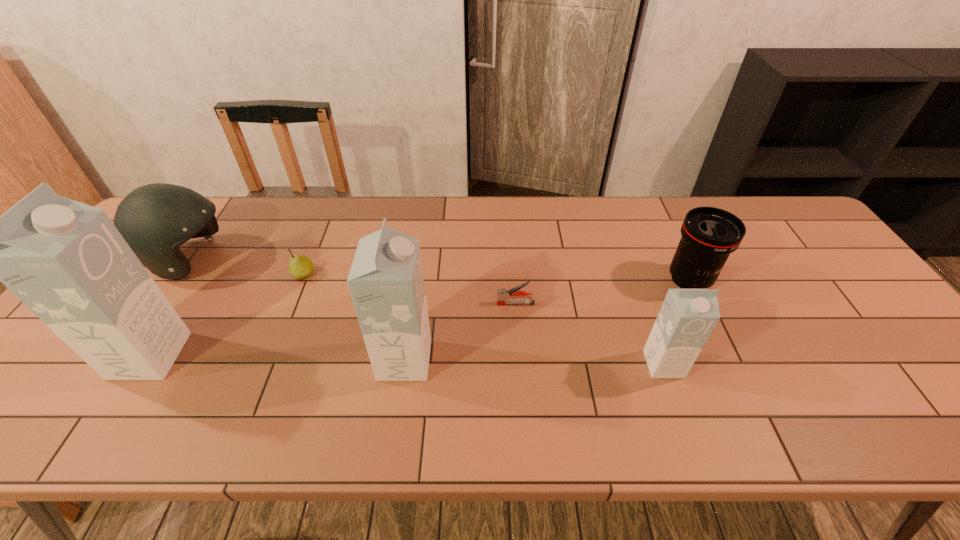
I want to click on the leftmost carton, so click(x=66, y=261).

Image resolution: width=960 pixels, height=540 pixels. What are the coordinates of `the second tallest carton` in the screenshot? It's located at (386, 282).

You are a GUI agent. You are given a task and a screenshot of the screen. Output one action in this format:
    pyautogui.click(x=<x>, y=<y>)
    Task: Click on the second tallest object
    
    Given the screenshot: What is the action you would take?
    pyautogui.click(x=386, y=282)

This screenshot has height=540, width=960. What are the coordinates of `the second object from right to left` in the screenshot? It's located at (687, 317).

Identify the location of the rightmost carton. Image resolution: width=960 pixels, height=540 pixels. (687, 317).

At what (x,y) coordinates should I click in order to perform the action: click on the rightmost object. Please return your answer as a coordinate pair (x, y). Looking at the image, I should click on (709, 234).

I want to click on telephoto lens, so click(709, 234).

Find the location of a particular element. The height and width of the screenshot is (540, 960). football helmet is located at coordinates (156, 219).

The width and height of the screenshot is (960, 540). What are the coordinates of `the third object from right to left` in the screenshot? It's located at pyautogui.click(x=503, y=295).

Locate an element on the screen. This screenshot has width=960, height=540. the fourth farthest object is located at coordinates (503, 295).